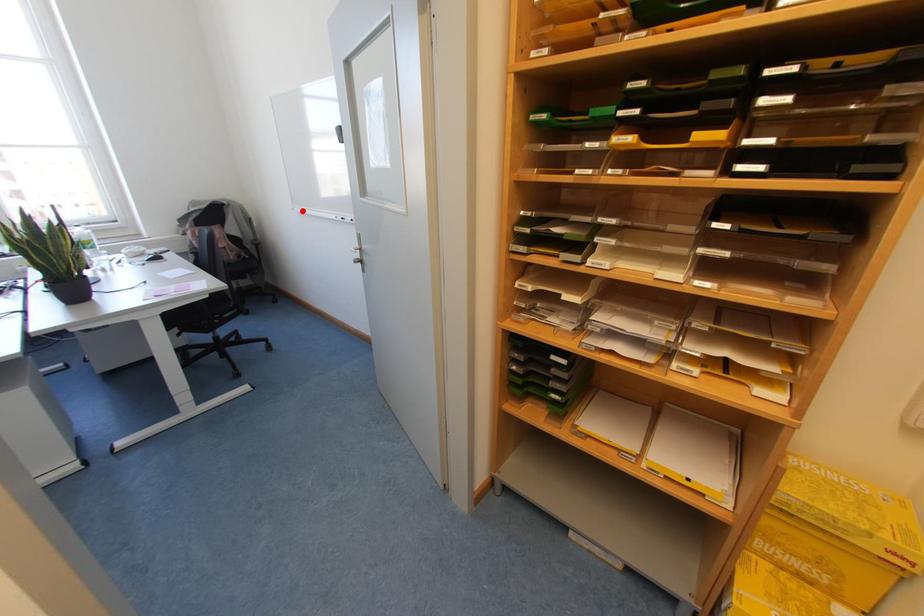
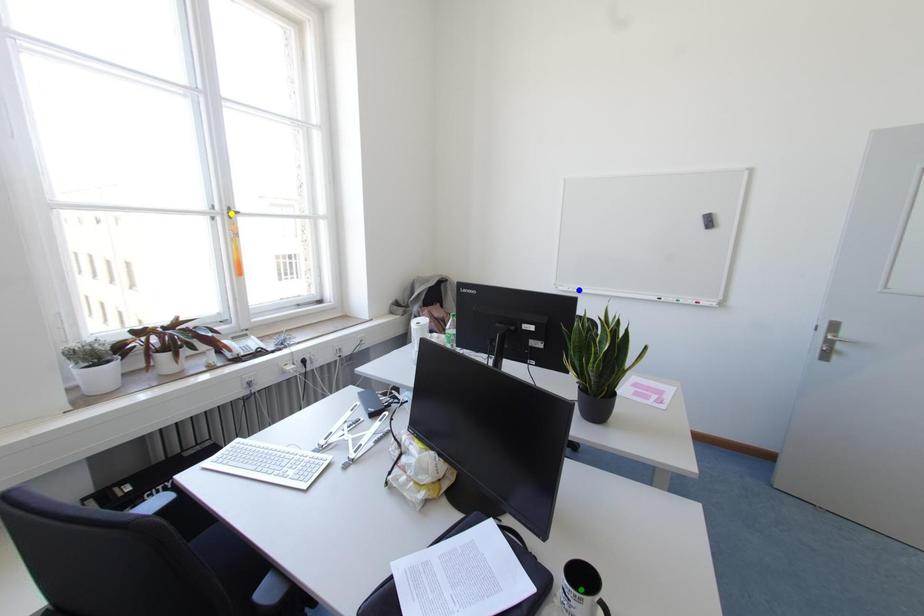
Question: I am providing you with two images of the same scene from different viewpoints. A red point is marked on the first image. You are given multiple points on the second image. Which mark in image 2 goes with the point in image 1?

Choices:
 (A) blue point
 (B) yellow point
 (C) green point

Answer: (A)